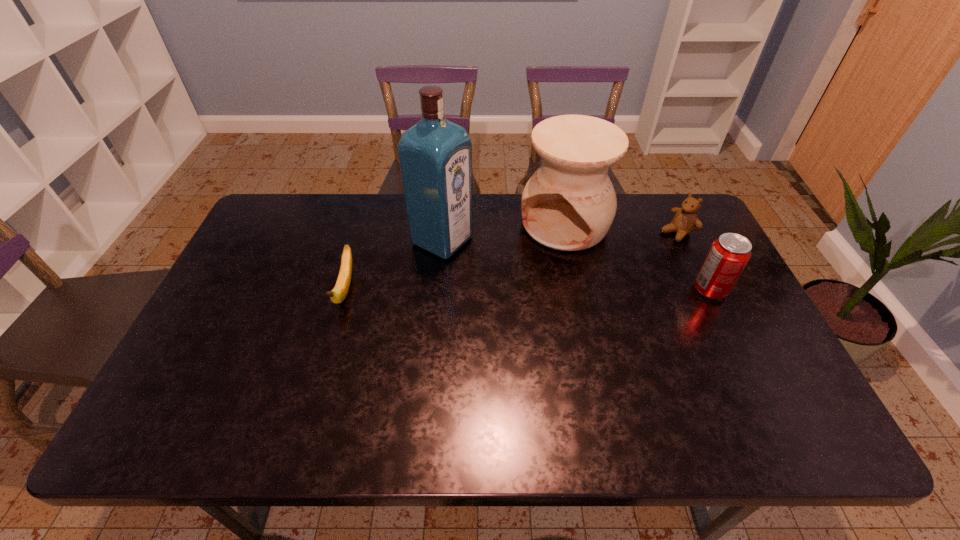
At what (x,y) coordinates should I click in order to perform the action: click on the shortest object. Please return your answer as a coordinate pair (x, y). Image resolution: width=960 pixels, height=540 pixels. Looking at the image, I should click on (338, 294).

In order to click on the leftmost object in this screenshot , I will do `click(338, 294)`.

Where is `soda`? soda is located at coordinates (729, 254).

The width and height of the screenshot is (960, 540). I want to click on the fourth shortest object, so click(x=569, y=203).

Locate an element on the screen. the third object from left to right is located at coordinates (569, 203).

I want to click on the tallest object, so click(x=435, y=155).

Image resolution: width=960 pixels, height=540 pixels. In order to click on the second object from left to right in this screenshot , I will do `click(435, 155)`.

Where is `the second shortest object`? This screenshot has width=960, height=540. the second shortest object is located at coordinates (685, 220).

In order to click on free space located at the stem of the leftmost object in this screenshot , I will do `click(328, 350)`.

Find the location of a particular element. Image resolution: width=960 pixels, height=540 pixels. free space located 0.190m on the back of the soda is located at coordinates [684, 235].